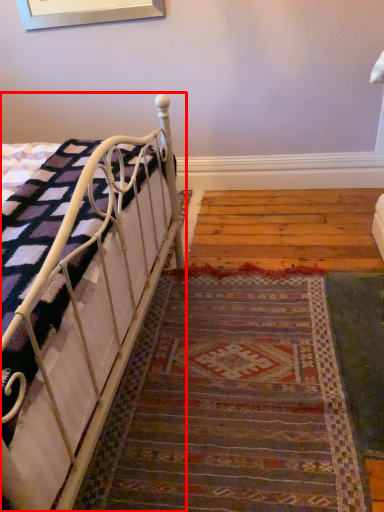
Question: Where is bed (annotated by the red box) located in relation to doormat in the image?

Choices:
 (A) left
 (B) right

Answer: (A)